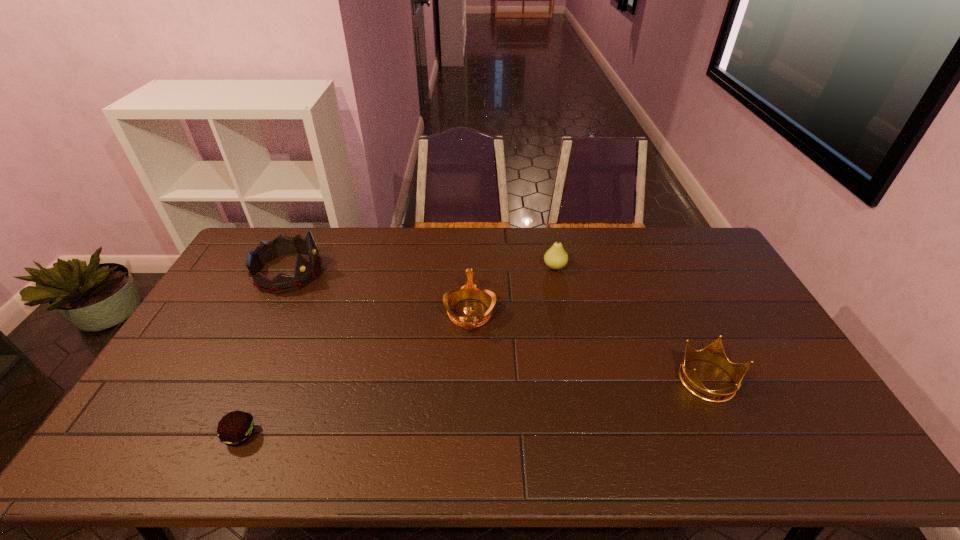
You are a GUI agent. You are given a task and a screenshot of the screen. Output one action in this format:
    pyautogui.click(x=<x>, y=<y>)
    Task: Click on the empty space between the right tiara and the fourth tallest object
    
    Given the screenshot: What is the action you would take?
    pyautogui.click(x=589, y=347)

This screenshot has height=540, width=960. What are the coordinates of `free spot between the second object from right to left and the left tiara` in the screenshot? It's located at (421, 269).

This screenshot has height=540, width=960. I want to click on vacant point located between the rightmost object and the shortest object, so click(474, 408).

Find the location of `object that stands as the second closest to the fourth farthest object`. object that stands as the second closest to the fourth farthest object is located at coordinates (469, 291).

Identify which object is the fourth nearest to the shortest object. Please provide its 2D coordinates. Your answer should be formatted as a tuple, i.e. [(x, y)], where the tuple contains the x and y coordinates of a point satisfying the conditions above.

[(715, 353)]

What are the coordinates of `free space that satisfies the following two spatial constraints: 1. at the front emblem of the fourth farthest object; 2. on the right side of the right tiara` in the screenshot? It's located at (468, 381).

Locate an element on the screen. free space that satisfies the following two spatial constraints: 1. at the front of the fourth farthest object with jewels; 2. on the left side of the tallest object is located at coordinates (233, 381).

The height and width of the screenshot is (540, 960). Find the location of `vacant area in the image that satisfies the following two spatial constraints: 1. at the front of the left tiara with jewels; 2. on the back side of the patty`. vacant area in the image that satisfies the following two spatial constraints: 1. at the front of the left tiara with jewels; 2. on the back side of the patty is located at coordinates (206, 435).

Locate an element on the screen. vacant space that satisfies the following two spatial constraints: 1. at the front of the taller tiara with jewels; 2. on the back side of the crown is located at coordinates (233, 381).

This screenshot has height=540, width=960. I want to click on vacant space that satisfies the following two spatial constraints: 1. at the front emblem of the right tiara; 2. on the left side of the rightmost object, so click(x=468, y=381).